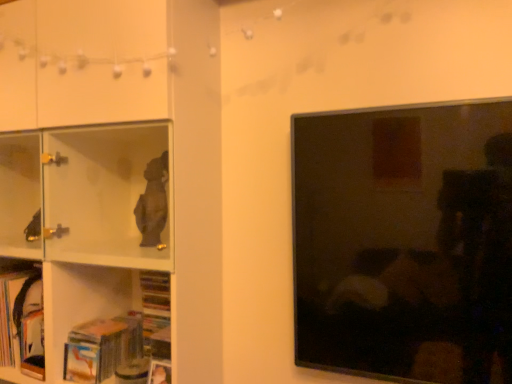
Question: Does white glossy shelf at left have a smaller size compared to hardcover book at lower left, which is the 2th book from right to left?

Choices:
 (A) yes
 (B) no

Answer: (B)

Question: Is white glossy shelf at left positioned behind hardcover book at lower left, which is the 1th book from left to right?

Choices:
 (A) yes
 (B) no

Answer: (B)

Question: Is white glossy shelf at left touching hardcover book at lower left, which is the 2th book from right to left?

Choices:
 (A) no
 (B) yes

Answer: (A)

Question: From a real-world perspective, is white glossy shelf at left physically above hardcover book at lower left, which is the 1th book from left to right?

Choices:
 (A) no
 (B) yes

Answer: (B)

Question: From a real-world perspective, is white glossy shelf at left beneath hardcover book at lower left, which is the 2th book from right to left?

Choices:
 (A) yes
 (B) no

Answer: (B)

Question: Is white glossy shelf at left shorter than hardcover book at lower left, which is the 2th book from right to left?

Choices:
 (A) no
 (B) yes

Answer: (A)

Question: Does hardcover book at lower left, which is the 1th book from left to right, have a smaller size compared to matte black tv at right?

Choices:
 (A) no
 (B) yes

Answer: (B)

Question: Is hardcover book at lower left, which is the 2th book from right to left, wider than matte black tv at right?

Choices:
 (A) no
 (B) yes

Answer: (B)

Question: Can you confirm if hardcover book at lower left, which is the 2th book from right to left, is bigger than matte black tv at right?

Choices:
 (A) yes
 (B) no

Answer: (B)

Question: Is hardcover book at lower left, which is the 2th book from right to left, to the right of matte black tv at right from the viewer's perspective?

Choices:
 (A) no
 (B) yes

Answer: (A)

Question: Is hardcover book at lower left, which is the 1th book from left to right, surrounding matte black tv at right?

Choices:
 (A) no
 (B) yes

Answer: (A)

Question: Is hardcover book at lower left, which is the 2th book from right to left, aimed at matte black tv at right?

Choices:
 (A) no
 (B) yes

Answer: (A)

Question: Does hardcover book at lower left, acting as the second book starting from the left, appear on the right side of white glossy shelf at left?

Choices:
 (A) no
 (B) yes

Answer: (B)